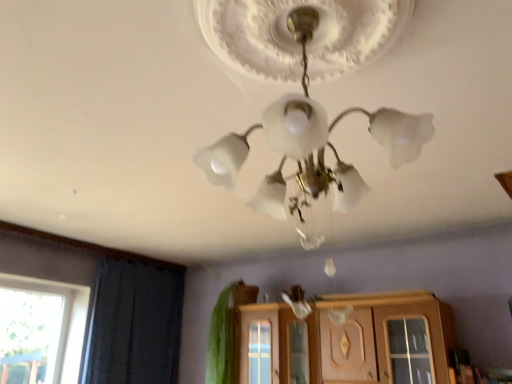
Question: Should I look upward or downward to see dark blue fabric at left?

Choices:
 (A) down
 (B) up

Answer: (A)